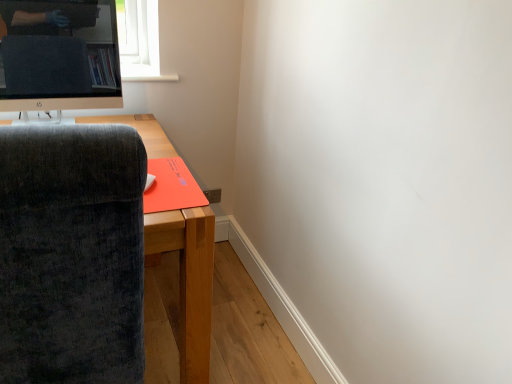
Question: From the image's perspective, relative to satin black monitor at upper left, is velvet dark gray chair at left above or below?

Choices:
 (A) below
 (B) above

Answer: (A)

Question: Relative to satin black monitor at upper left, is velvet dark gray chair at left in front or behind?

Choices:
 (A) front
 (B) behind

Answer: (A)

Question: Estimate the real-world distances between objects in this image. Which object is farther from the velvet dark gray chair at left?

Choices:
 (A) orange matte mousepad at lower left
 (B) dark gray fabric chair at left
 (C) satin black monitor at upper left

Answer: (C)

Question: Estimate the real-world distances between objects in this image. Which object is closer to the dark gray fabric chair at left?

Choices:
 (A) satin black monitor at upper left
 (B) orange matte mousepad at lower left
 (C) velvet dark gray chair at left

Answer: (A)